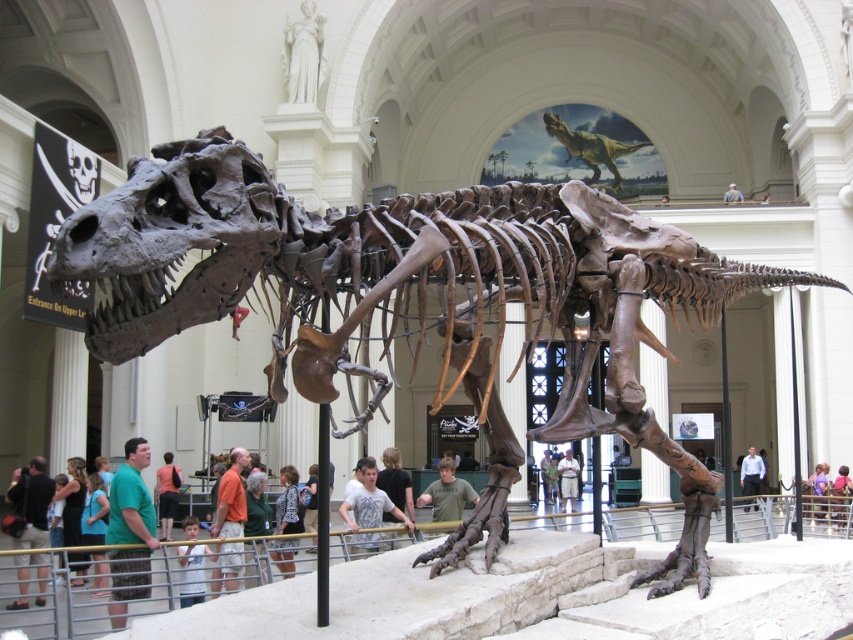
Does black textured shirt at center have a smaller size compared to light blue shirt at lower center?

No, black textured shirt at center is not smaller than light blue shirt at lower center.

Is point (297, 529) more distant than point (200, 588)?

Yes, point (297, 529) is farther from viewer.

Is point (277, 529) closer to viewer compared to point (202, 560)?

No, (277, 529) is behind (202, 560).

Locate an element on the screen. The image size is (853, 640). black textured shirt at center is located at coordinates (287, 502).

Can you confirm if orange shirt at center is bigger than light brown fabric shirt at center?

Incorrect, orange shirt at center is not larger than light brown fabric shirt at center.

Which is in front, point (170, 509) or point (567, 477)?

Point (170, 509) is more forward.

Is point (172, 465) farther from camera compared to point (558, 472)?

No, it is in front of (558, 472).

Locate an element on the screen. orange shirt at center is located at coordinates (167, 493).

Which is behind, point (138, 438) or point (611, 145)?

The point (611, 145) is behind.

Who is higher up, green fabric shirt at lower left or green textured dinosaur at upper center?

green textured dinosaur at upper center is above.

Is point (136, 467) behind point (602, 150)?

That is False.

Find the location of a particular element. The width and height of the screenshot is (853, 640). green fabric shirt at lower left is located at coordinates (131, 531).